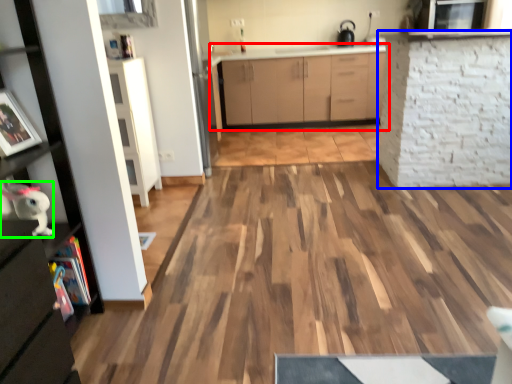
Question: Which object is positioned closest to cabinetry (highlighted by a red box)? Select from shelf (highlighted by a blue box) and toy (highlighted by a green box).

Choices:
 (A) shelf
 (B) toy

Answer: (A)